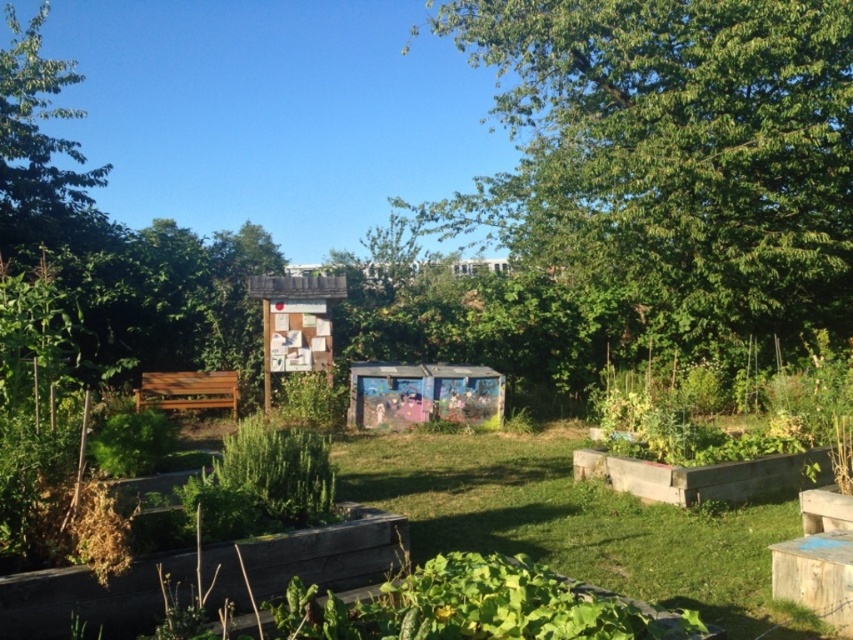
Who is taller, green grass at center or green leafy tree at upper left?

green leafy tree at upper left

Describe the element at coordinates (575, 522) in the screenshot. This screenshot has width=853, height=640. I see `green grass at center` at that location.

I want to click on green grass at center, so click(x=575, y=522).

Does green leafy tree at upper center have a lesser height compared to green leafy tree at upper left?

In fact, green leafy tree at upper center may be taller than green leafy tree at upper left.

Is green leafy tree at upper center closer to the viewer compared to green leafy tree at upper left?

Yes.

Who is more distant from viewer, (523, 68) or (24, 68)?

Positioned behind is point (523, 68).

Identify the location of green leafy tree at upper center. The height and width of the screenshot is (640, 853). (672, 154).

Who is more forward, (836,189) or (746,588)?

Point (746,588)

Can you confirm if green leafy tree at upper center is wider than green grass at center?

Correct, the width of green leafy tree at upper center exceeds that of green grass at center.

The width and height of the screenshot is (853, 640). I want to click on green leafy tree at upper center, so click(x=672, y=154).